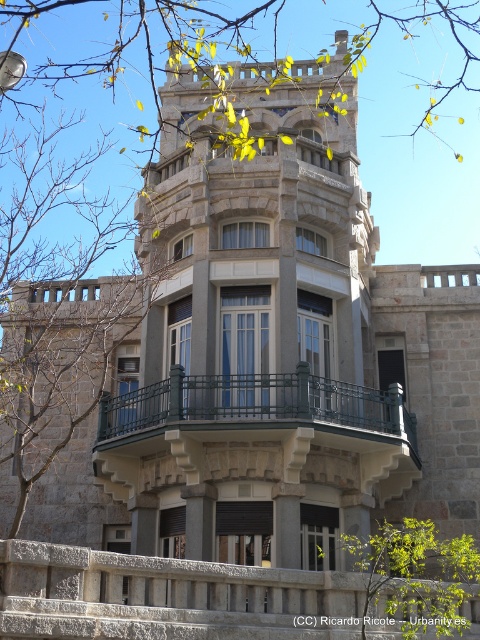
Question: Among these points, which one is nearest to the camera?

Choices:
 (A) (446, 598)
 (B) (141, 636)

Answer: (B)

Question: Which point appears closest to the camera in this image?

Choices:
 (A) (155, 573)
 (B) (139, 444)

Answer: (A)

Question: Considering the relative positions of gray stone balustrade at lower center and green leafy tree at center in the image provided, where is gray stone balustrade at lower center located with respect to green leafy tree at center?

Choices:
 (A) left
 (B) right

Answer: (A)

Question: Is gray stone balustrade at lower center bigger than green leafy tree at center?

Choices:
 (A) no
 (B) yes

Answer: (B)

Question: Which point is farther to the camera?

Choices:
 (A) green wrought iron balcony at center
 (B) gray stone balustrade at lower center
 (C) green leafy tree at center

Answer: (A)

Question: Can you confirm if gray stone balustrade at lower center is bigger than green wrought iron balcony at center?

Choices:
 (A) yes
 (B) no

Answer: (B)